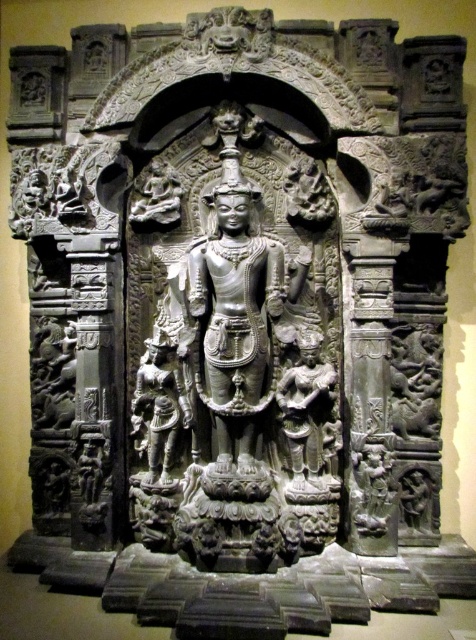
Question: Which object is farther from the camera taking this photo?

Choices:
 (A) gray stone figure at lower left
 (B) dark gray stone statue at center

Answer: (A)

Question: Is dark gray stone statue at center positioned before gray stone figure at lower left?

Choices:
 (A) no
 (B) yes

Answer: (B)

Question: Which point is farther to the camera?

Choices:
 (A) dark gray stone statue at center
 (B) gray stone figure at lower left

Answer: (B)

Question: Does dark gray stone statue at center lie behind gray stone figure at lower left?

Choices:
 (A) yes
 (B) no

Answer: (B)

Question: Can you confirm if dark gray stone statue at center is smaller than gray stone figure at lower left?

Choices:
 (A) no
 (B) yes

Answer: (A)